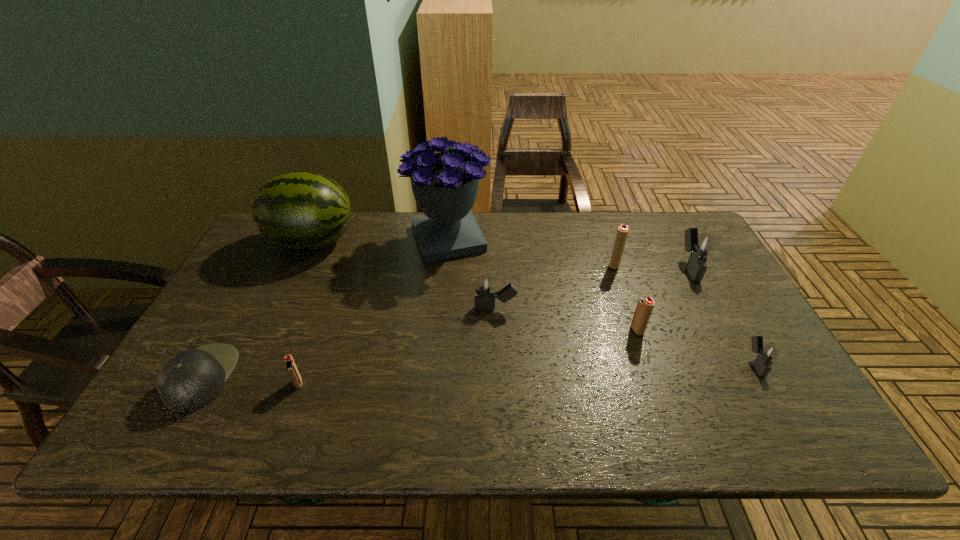
At what (x,y) coordinates should I click in order to perform the action: click on the nearest red igniter. Please return your answer as a coordinate pair (x, y). Looking at the image, I should click on (290, 365).

Locate an element on the screen. the leftmost igniter is located at coordinates (290, 365).

Locate an element on the screen. This screenshot has width=960, height=540. the nearest gray igniter is located at coordinates (766, 356).

The height and width of the screenshot is (540, 960). In order to click on cap in this screenshot , I will do `click(190, 380)`.

You are a GUI agent. You are given a task and a screenshot of the screen. Output one action in this format:
    pyautogui.click(x=<x>, y=<y>)
    Task: Click on the free space located on the front of the purple bouquet
    The height and width of the screenshot is (540, 960).
    Given the screenshot: What is the action you would take?
    pyautogui.click(x=439, y=354)

Find the location of a particular element. The width and height of the screenshot is (960, 540). vacant space positioned at the stem end of the second tallest object is located at coordinates (413, 241).

Locate an element on the screen. free location located 0.290m on the front of the biggest red igniter is located at coordinates (643, 346).

Where is `free space located 0.210m on the back of the biggest gray igniter`? The image size is (960, 540). free space located 0.210m on the back of the biggest gray igniter is located at coordinates (660, 214).

Locate an element on the screen. This screenshot has width=960, height=540. free spot located on the back of the fifth igniter from right to left is located at coordinates (493, 244).

Where is `vacant space located 0.230m on the front of the fourth nearest object`? vacant space located 0.230m on the front of the fourth nearest object is located at coordinates (667, 417).